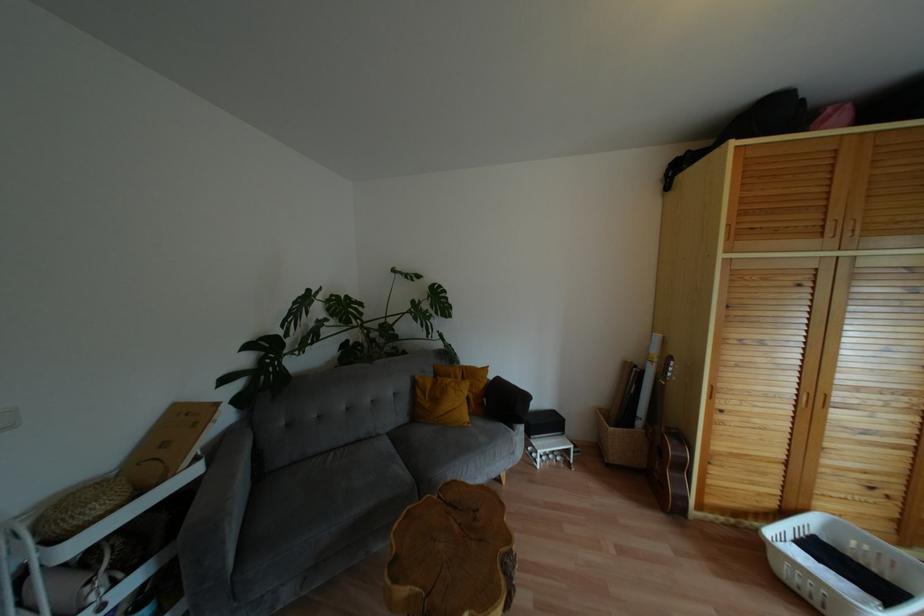
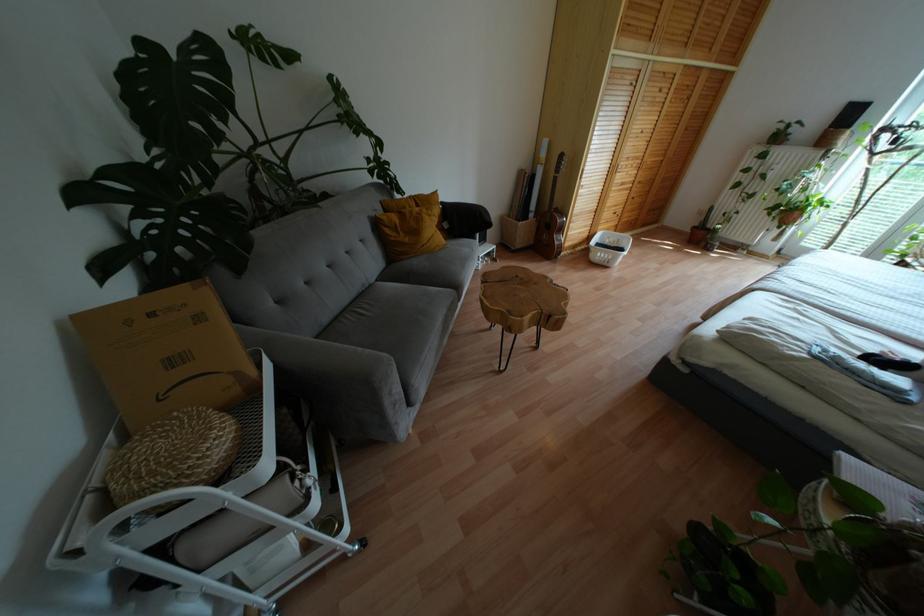
Locate, in the second image, the point that corresponds to point (682, 467) in the first image.

(560, 229)